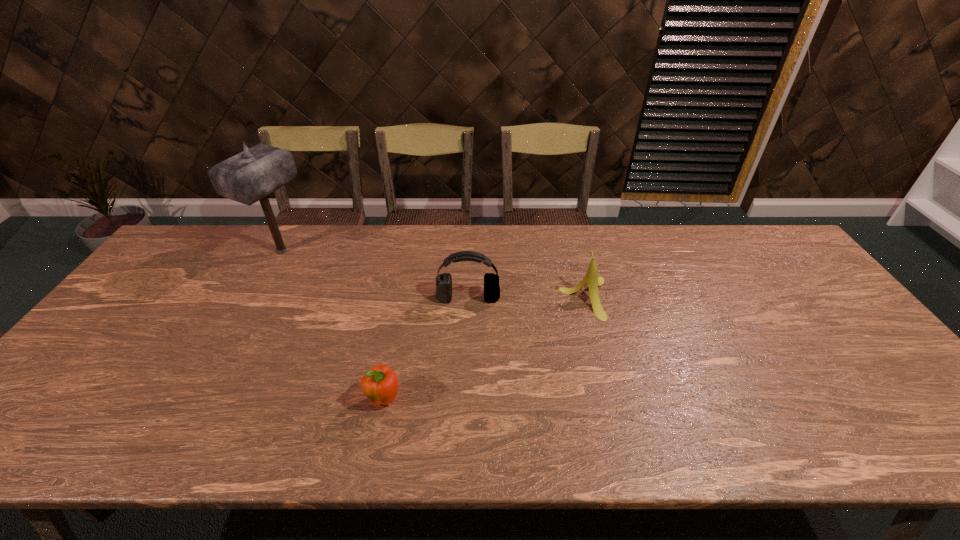
Locate an element on the screen. This screenshot has width=960, height=540. vacant space that satisfies the following two spatial constraints: 1. on the front side of the mallet; 2. on the left side of the pepper is located at coordinates click(x=200, y=401).

Find the location of `free space that satisfies the following two spatial constraints: 1. on the headband of the second tallest object; 2. on the right side of the banana`. free space that satisfies the following two spatial constraints: 1. on the headband of the second tallest object; 2. on the right side of the banana is located at coordinates (468, 298).

Identify the location of free space that satisfies the following two spatial constraints: 1. on the back side of the second object from left to right; 2. on the left side of the rightmost object. The image size is (960, 540). coord(404,298).